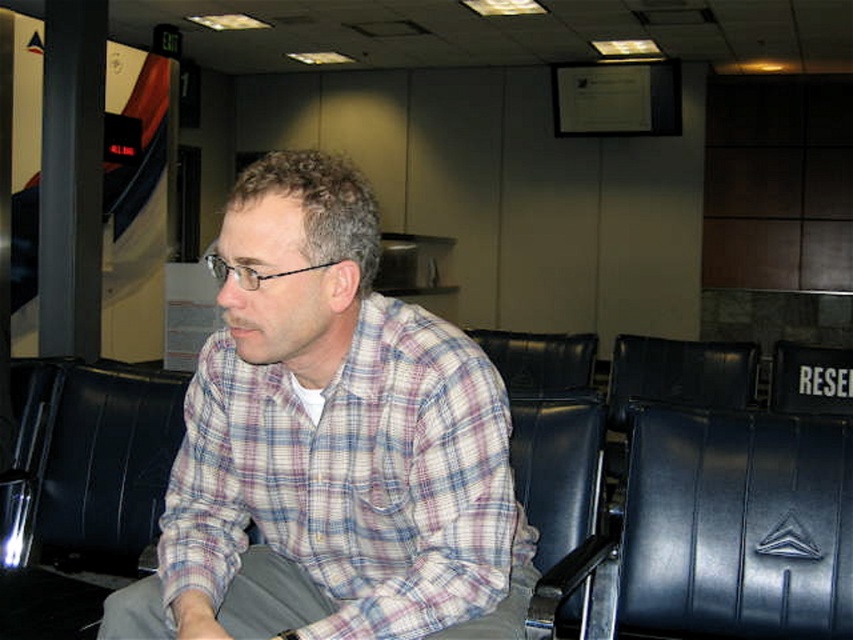
Question: Is plaid cotton shirt at center bigger than black leather swivel chair at center?

Choices:
 (A) no
 (B) yes

Answer: (B)

Question: Which of the following is the farthest from the observer?

Choices:
 (A) black leather swivel chair at center
 (B) black leather armchair at left
 (C) plaid cotton shirt at center

Answer: (A)

Question: Can you confirm if black leather swivel chair at center is smaller than black leather armchair at left?

Choices:
 (A) no
 (B) yes

Answer: (B)

Question: Among these points, which one is farthest from the camera?

Choices:
 (A) (782, 468)
 (B) (198, 493)
 (C) (109, 388)

Answer: (C)

Question: Which object is positioned farthest from the black leather swivel chair at center?

Choices:
 (A) plaid cotton shirt at center
 (B) black leather armchair at left

Answer: (B)

Question: Is black leather swivel chair at center positioned in front of black leather armchair at left?

Choices:
 (A) yes
 (B) no

Answer: (B)